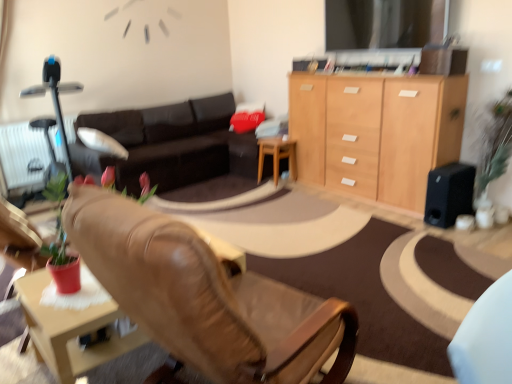
Question: Is dark brown leather couch at center next to leather chair at center and touching it?

Choices:
 (A) no
 (B) yes

Answer: (A)

Question: Is dark brown leather couch at center facing away from leather chair at center?

Choices:
 (A) yes
 (B) no

Answer: (B)

Question: Does dark brown leather couch at center have a larger size compared to leather chair at center?

Choices:
 (A) no
 (B) yes

Answer: (B)

Question: From a real-world perspective, is dark brown leather couch at center physically below leather chair at center?

Choices:
 (A) yes
 (B) no

Answer: (A)

Question: Is dark brown leather couch at center in front of leather chair at center?

Choices:
 (A) yes
 (B) no

Answer: (B)

Question: Considering their positions, is wooden at center located in front of or behind dark brown leather couch at center?

Choices:
 (A) front
 (B) behind

Answer: (B)

Question: From the image's perspective, is wooden at center above or below dark brown leather couch at center?

Choices:
 (A) above
 (B) below

Answer: (B)

Question: Is wooden at center wider or thinner than dark brown leather couch at center?

Choices:
 (A) wide
 (B) thin

Answer: (B)

Question: Does point (264, 153) appear closer or farther from the camera than point (187, 142)?

Choices:
 (A) closer
 (B) farther

Answer: (A)

Question: Considering the positions of point click(x=162, y=157) and point click(x=434, y=205), is point click(x=162, y=157) closer or farther from the camera than point click(x=434, y=205)?

Choices:
 (A) closer
 (B) farther

Answer: (B)

Question: In terms of height, does dark brown leather couch at center look taller or shorter compared to black matte speaker at right?

Choices:
 (A) short
 (B) tall

Answer: (B)

Question: In terms of size, does dark brown leather couch at center appear bigger or smaller than black matte speaker at right?

Choices:
 (A) big
 (B) small

Answer: (A)

Question: Which is correct: dark brown leather couch at center is inside black matte speaker at right, or outside of it?

Choices:
 (A) outside
 (B) inside

Answer: (A)

Question: Looking at their shapes, would you say dark brown leather couch at center is wider or thinner than white textured radiator at left?

Choices:
 (A) thin
 (B) wide

Answer: (B)

Question: Does point (117, 127) appear closer or farther from the camera than point (7, 165)?

Choices:
 (A) closer
 (B) farther

Answer: (B)